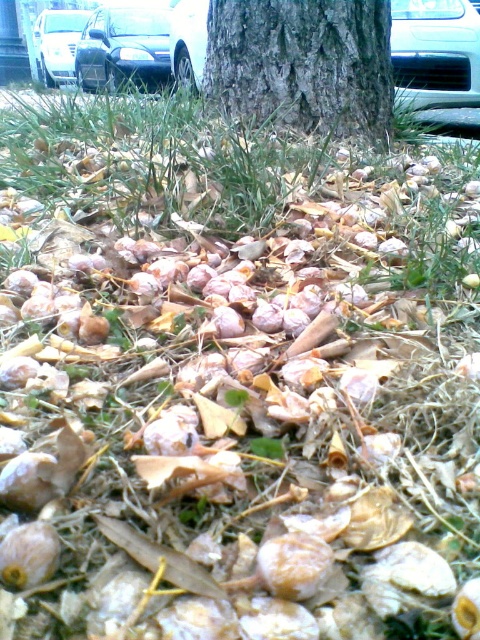
Question: Which object is the farthest from the metallic silver car at upper left?

Choices:
 (A) metallic silver car at upper right
 (B) brown rough tree trunk at center

Answer: (B)

Question: Is brown rough tree trunk at center to the right of metallic silver car at upper right from the viewer's perspective?

Choices:
 (A) yes
 (B) no

Answer: (B)

Question: Is metallic silver car at upper right to the right of silver metallic car at upper left from the viewer's perspective?

Choices:
 (A) no
 (B) yes

Answer: (B)

Question: Among these objects, which one is farthest from the camera?

Choices:
 (A) brown rough tree trunk at center
 (B) metallic silver car at upper left

Answer: (B)

Question: Where is metallic silver car at upper right located in relation to metallic silver car at upper left in the image?

Choices:
 (A) above
 (B) below

Answer: (B)

Question: Which object appears farthest from the camera in this image?

Choices:
 (A) metallic silver car at upper right
 (B) metallic silver car at upper left

Answer: (B)